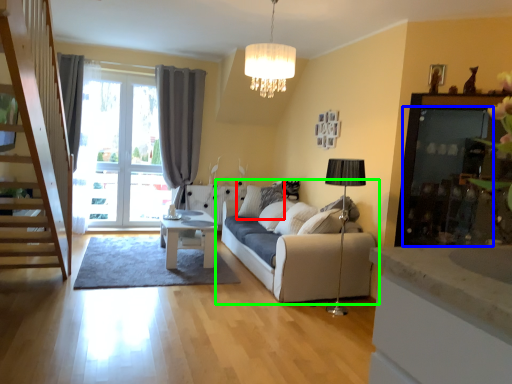
Question: Which object is the farthest from pillow (highlighted by a red box)? Choose among these: screen door (highlighted by a blue box) or studio couch (highlighted by a green box).

Choices:
 (A) screen door
 (B) studio couch

Answer: (A)